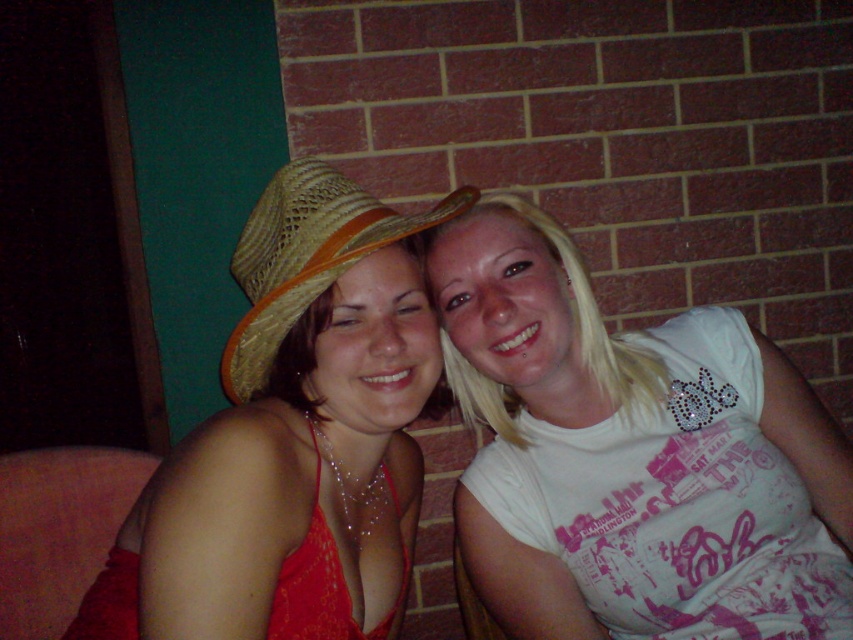
Question: Which point is farther to the camera?

Choices:
 (A) (309, 168)
 (B) (486, 211)
 (C) (407, 573)

Answer: (C)

Question: Is white shiny t-shirt at center above strawhat at center?

Choices:
 (A) yes
 (B) no

Answer: (B)

Question: Does white shiny t-shirt at center have a smaller size compared to strawhat at center?

Choices:
 (A) yes
 (B) no

Answer: (B)

Question: Which of the following is the closest to the observer?

Choices:
 (A) (303, 195)
 (B) (186, 602)

Answer: (B)

Question: Which object is farther from the camera taking this photo?

Choices:
 (A) white shiny t-shirt at center
 (B) strawhat at center

Answer: (A)

Question: Does white shiny t-shirt at center appear on the right side of strawhat at center?

Choices:
 (A) no
 (B) yes

Answer: (B)